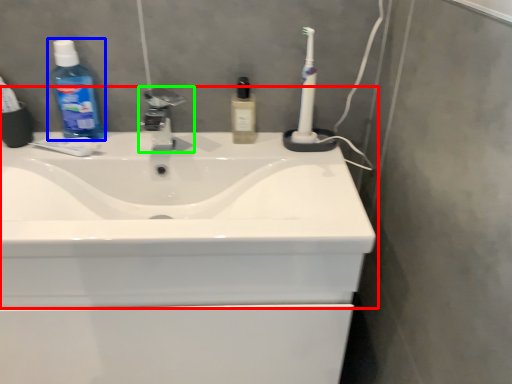
Question: Based on their relative distances, which object is farther from sink (highlighted by a red box)? Choose from cleaning product (highlighted by a blue box) and tap (highlighted by a green box).

Choices:
 (A) cleaning product
 (B) tap

Answer: (A)